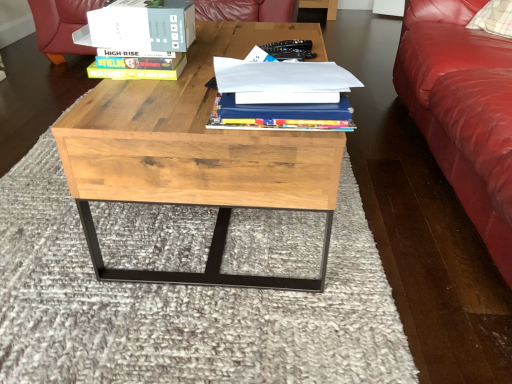
The image size is (512, 384). Describe the element at coordinates (197, 155) in the screenshot. I see `natural wood coffee table at center` at that location.

What do you see at coordinates (281, 94) in the screenshot? This screenshot has width=512, height=384. I see `blue hardcover book at center` at bounding box center [281, 94].

Locate an element on the screen. natural wood coffee table at center is located at coordinates (197, 155).

Which is more to the left, blue hardcover book at center or hardcover book at upper left?

hardcover book at upper left is more to the left.

Between blue hardcover book at center and hardcover book at upper left, which one has larger width?

With larger width is blue hardcover book at center.

From a real-world perspective, does blue hardcover book at center sit lower than hardcover book at upper left?

No, from a real-world perspective, blue hardcover book at center is not under hardcover book at upper left.

Looking at this image, would you say blue hardcover book at center is outside hardcover book at upper left?

blue hardcover book at center lies outside hardcover book at upper left's area.

Are natural wood coffee table at center and hardcover book at upper left far apart?

No, natural wood coffee table at center is not far away from hardcover book at upper left.

Is hardcover book at upper left surrounded by natural wood coffee table at center?

That's incorrect, hardcover book at upper left is not inside natural wood coffee table at center.

From the picture: Does natural wood coffee table at center appear on the left side of hardcover book at upper left?

Incorrect, natural wood coffee table at center is not on the left side of hardcover book at upper left.

How many degrees apart are the facing directions of natural wood coffee table at center and hardcover book at upper left?

natural wood coffee table at center and hardcover book at upper left are facing 2.82 degrees away from each other.

Does point (126, 177) appear closer or farther from the camera than point (172, 37)?

Point (126, 177) is positioned closer to the camera compared to point (172, 37).

Is white cardboard box at upper center at the back of natural wood coffee table at center?

natural wood coffee table at center is not turned away from white cardboard box at upper center.

Is natural wood coffee table at center bigger than white cardboard box at upper center?

Correct, natural wood coffee table at center is larger in size than white cardboard box at upper center.

From the image's perspective, is natural wood coffee table at center above or below white cardboard box at upper center?

natural wood coffee table at center is below white cardboard box at upper center.

From the picture: Between hardcover book at upper left and blue hardcover book at center, which one has less height?

hardcover book at upper left.

From a real-world perspective, does hardcover book at upper left sit lower than blue hardcover book at center?

Yes, from a real-world perspective, hardcover book at upper left is beneath blue hardcover book at center.

Could you tell me if hardcover book at upper left is facing blue hardcover book at center?

No, hardcover book at upper left is not aimed at blue hardcover book at center.

From the picture: Is blue hardcover book at center at the back of white cardboard box at upper center?

No.

Can we say white cardboard box at upper center lies outside blue hardcover book at center?

Yes, white cardboard box at upper center is located beyond the bounds of blue hardcover book at center.

Between white cardboard box at upper center and blue hardcover book at center, which one has smaller size?

white cardboard box at upper center.

Can you confirm if white cardboard box at upper center is thinner than blue hardcover book at center?

Indeed, white cardboard box at upper center has a lesser width compared to blue hardcover book at center.

Based on the photo, does blue hardcover book at center have a greater height compared to white cardboard box at upper center?

In fact, blue hardcover book at center may be shorter than white cardboard box at upper center.

Is blue hardcover book at center closer to the viewer compared to white cardboard box at upper center?

That is True.

Is blue hardcover book at center directly adjacent to white cardboard box at upper center?

No, blue hardcover book at center is not in contact with white cardboard box at upper center.

Which point is more distant from viewer, (224,111) or (170,39)?

The point (170,39) is more distant.

In the scene shown: Based on their positions, is white cardboard box at upper center located to the left or right of natural wood coffee table at center?

white cardboard box at upper center is to the left of natural wood coffee table at center.

Consider the image. Can you confirm if white cardboard box at upper center is smaller than natural wood coffee table at center?

Yes.

From a real-world perspective, relative to natural wood coffee table at center, is white cardboard box at upper center vertically above or below?

white cardboard box at upper center is situated higher than natural wood coffee table at center in the real world.

I want to click on book lying below the hardcover book at upper left (from the image's perspective), so click(x=281, y=94).

I want to click on coffee table located on the right of hardcover book at upper left, so click(197, 155).

From the image, which object appears to be nearer to blue hardcover book at center, white cardboard box at upper center or natural wood coffee table at center?

natural wood coffee table at center is positioned closer to the anchor blue hardcover book at center.

From the image, which object appears to be nearer to hardcover book at upper left, blue hardcover book at center or natural wood coffee table at center?

natural wood coffee table at center lies closer to hardcover book at upper left than the other object.

Which object lies nearer to the anchor point white cardboard box at upper center, blue hardcover book at center or hardcover book at upper left?

The object closer to white cardboard box at upper center is hardcover book at upper left.

Estimate the real-world distances between objects in this image. Which object is closer to hardcover book at upper left, white cardboard box at upper center or natural wood coffee table at center?

The object closer to hardcover book at upper left is white cardboard box at upper center.

From the image, which object appears to be farther from blue hardcover book at center, white cardboard box at upper center or hardcover book at upper left?

hardcover book at upper left is further to blue hardcover book at center.

In the scene shown: From the image, which object appears to be farther from white cardboard box at upper center, natural wood coffee table at center or hardcover book at upper left?

Based on the image, natural wood coffee table at center appears to be further to white cardboard box at upper center.

Which object lies nearer to the anchor point natural wood coffee table at center, hardcover book at upper left or blue hardcover book at center?

blue hardcover book at center is positioned closer to the anchor natural wood coffee table at center.

Which object lies nearer to the anchor point natural wood coffee table at center, hardcover book at upper left or white cardboard box at upper center?

Among the two, white cardboard box at upper center is located nearer to natural wood coffee table at center.

Identify the location of coffee table between hardcover book at upper left and blue hardcover book at center from left to right. (197, 155).

The width and height of the screenshot is (512, 384). I want to click on box situated between hardcover book at upper left and blue hardcover book at center from left to right, so click(143, 26).

In order to click on box between hardcover book at upper left and natural wood coffee table at center in the horizontal direction in this screenshot , I will do pos(143,26).

I want to click on coffee table located between white cardboard box at upper center and blue hardcover book at center in the left-right direction, so click(197, 155).